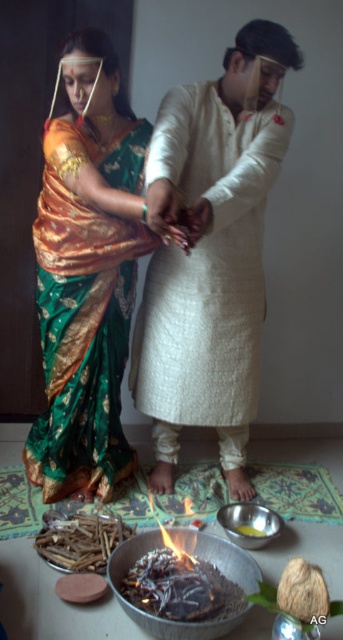
Question: Which point appears closest to the camera in this image?

Choices:
 (A) (253, 532)
 (B) (287, 32)
 (C) (71, 442)

Answer: (B)

Question: Which of these objects is positioned closest to the shiny silver bowl at center?

Choices:
 (A) green silk saree at center
 (B) white textured kurta at center

Answer: (B)

Question: Considering the relative positions of white textured kurta at center and green silk saree at center in the image provided, where is white textured kurta at center located with respect to green silk saree at center?

Choices:
 (A) below
 (B) above

Answer: (B)

Question: Is white textured kurta at center below shiny silver bowl at center?

Choices:
 (A) no
 (B) yes

Answer: (A)

Question: Is the position of white textured kurta at center more distant than that of shiny silver bowl at center?

Choices:
 (A) no
 (B) yes

Answer: (A)

Question: Which object is closer to the camera taking this photo?

Choices:
 (A) white textured kurta at center
 (B) green silk saree at center

Answer: (A)